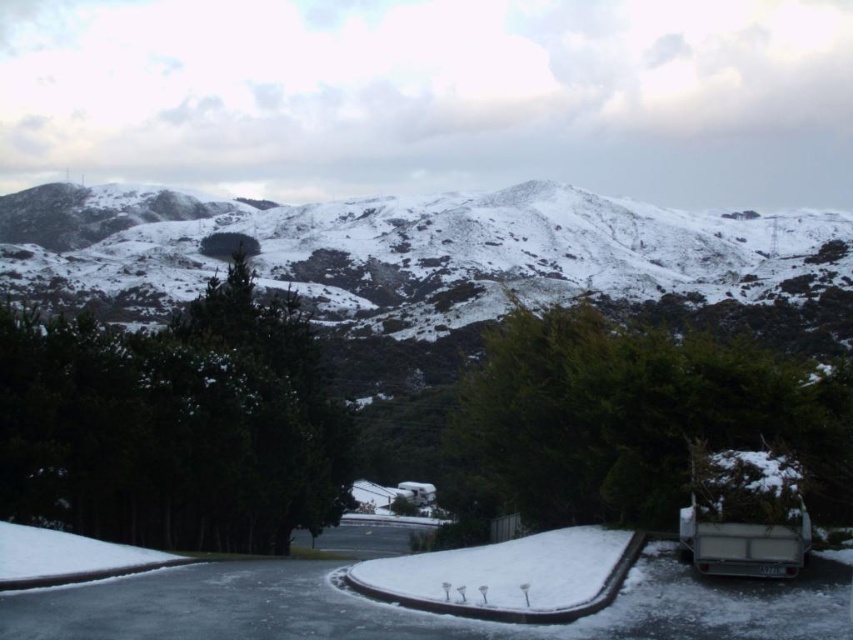
Question: Is snowy rock formation at upper center wider than green matte tree at center?

Choices:
 (A) no
 (B) yes

Answer: (B)

Question: Does snowy rock formation at upper center have a greater width compared to green matte tree at center?

Choices:
 (A) no
 (B) yes

Answer: (B)

Question: Is snowy rock formation at upper center above green textured tree at center?

Choices:
 (A) yes
 (B) no

Answer: (A)

Question: Estimate the real-world distances between objects in this image. Which object is farther from the green textured tree at center?

Choices:
 (A) green matte tree at center
 (B) snowy rock formation at upper center

Answer: (B)

Question: Which point is closer to the camera?

Choices:
 (A) snowy rock formation at upper center
 (B) green textured tree at center

Answer: (B)

Question: Which object is positioned farthest from the green textured tree at center?

Choices:
 (A) snowy rock formation at upper center
 (B) green matte tree at center

Answer: (A)